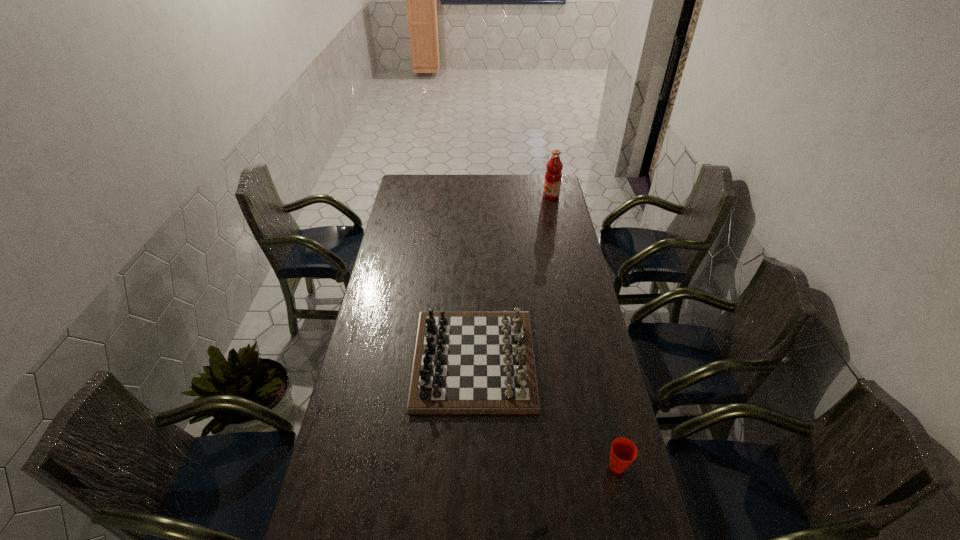
Identify the location of the farthest object. The width and height of the screenshot is (960, 540). (553, 176).

Locate an element on the screen. The image size is (960, 540). fruit juice is located at coordinates (553, 176).

Locate an element on the screen. This screenshot has height=540, width=960. the third nearest object is located at coordinates (465, 362).

The width and height of the screenshot is (960, 540). I want to click on the third farthest object, so click(623, 452).

Identify the location of vacant space situated on the front label of the tallest object. (525, 196).

Find the location of a particular element. blank space located 0.310m on the front label of the tallest object is located at coordinates (487, 196).

You are a GUI agent. You are given a task and a screenshot of the screen. Output one action in this format:
    pyautogui.click(x=<x>, y=<y>)
    Task: Click on the vacant space located 0.230m on the front label of the tallest object
    The width and height of the screenshot is (960, 540).
    Given the screenshot: What is the action you would take?
    pyautogui.click(x=501, y=196)

You are a GUI agent. You are given a task and a screenshot of the screen. Output one action in this format:
    pyautogui.click(x=<x>, y=<y>)
    Task: Click on the free space located from the player's perspective of the chessboard
    This screenshot has width=960, height=540.
    Given the screenshot: What is the action you would take?
    pyautogui.click(x=563, y=360)

You are a GUI agent. You are given a task and a screenshot of the screen. Output one action in this format:
    pyautogui.click(x=<x>, y=<y>)
    Task: Click on the vacant point located 0.330m on the back of the cup
    The image size is (960, 540).
    Given the screenshot: What is the action you would take?
    pyautogui.click(x=594, y=367)

Where is `object present at the far edge`? This screenshot has height=540, width=960. object present at the far edge is located at coordinates (553, 176).